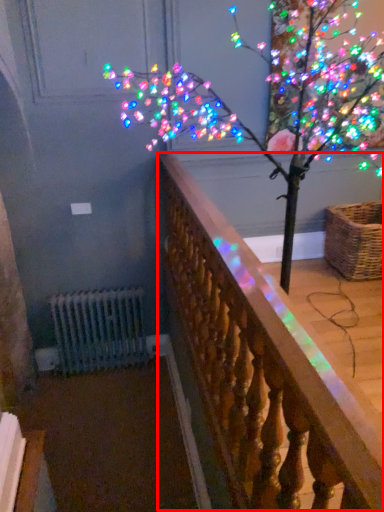
Question: Where is rail (annotated by the red box) located in relation to basket in the image?

Choices:
 (A) left
 (B) right

Answer: (A)